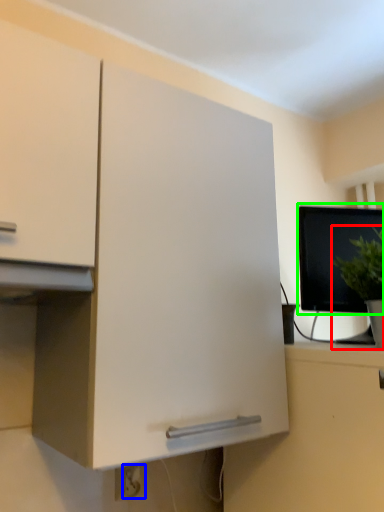
Question: Based on their relative distances, which object is nearer to houseplant (highlighted by a red box)? Choose from electric outlet (highlighted by a blue box) and computer monitor (highlighted by a green box).

Choices:
 (A) electric outlet
 (B) computer monitor

Answer: (B)